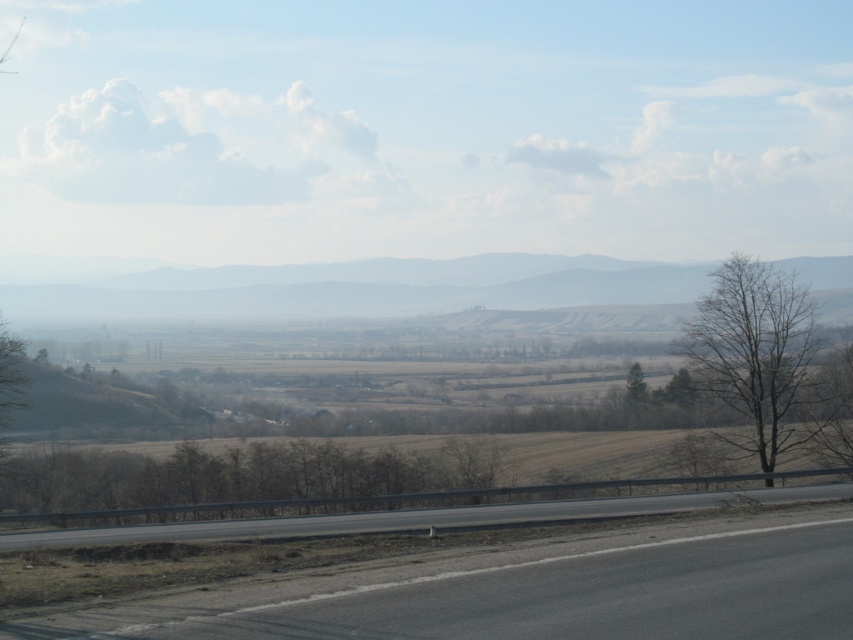
You are driving along the smooth asphalt highway at center and see a bare wood tree at right. Which one is taller?

The smooth asphalt highway at center is taller than the bare wood tree at right.

You are driving along the smooth asphalt highway at center and notice the foggy haze mountain at center in the distance. Which object is positioned higher in the scene?

The foggy haze mountain at center is positioned higher than the smooth asphalt highway at center in the scene.

You are driving a car that is 15 feet long. You need to park your car between the bare wood tree at right and the smooth asphalt highway at center. Is there enough space to park your car there?

The distance between the bare wood tree at right and the smooth asphalt highway at center is 80.10 feet. Since your car is only 15 feet long, there is more than enough space to park between them.